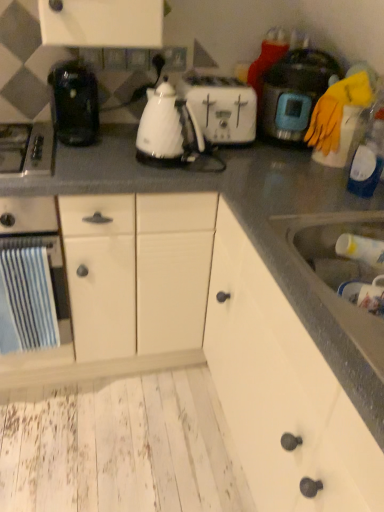
Image resolution: width=384 pixels, height=512 pixels. In order to click on free location to the right of white glossy electric kettle at center, which ranks as the second kitchen appliance in left-to-right order in this screenshot , I will do `click(220, 159)`.